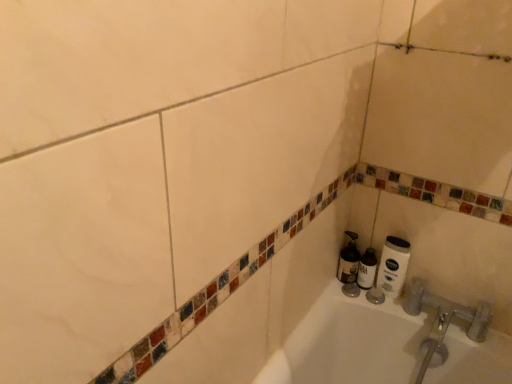
Question: Does white matte shaving cream at lower right, which appears as the first shaving cream when viewed from the left, have a lesser width compared to white matte toilet paper at lower right?

Choices:
 (A) yes
 (B) no

Answer: (B)

Question: Does white matte shaving cream at lower right, the 2th shaving cream from the right, have a lesser height compared to white matte toilet paper at lower right?

Choices:
 (A) yes
 (B) no

Answer: (A)

Question: Is white matte shaving cream at lower right, which appears as the first shaving cream when viewed from the left, oriented towards white matte toilet paper at lower right?

Choices:
 (A) no
 (B) yes

Answer: (A)

Question: Would you consider white matte shaving cream at lower right, which appears as the first shaving cream when viewed from the left, to be distant from white matte toilet paper at lower right?

Choices:
 (A) no
 (B) yes

Answer: (A)

Question: Is white matte shaving cream at lower right, the 2th shaving cream from the right, smaller than white matte toilet paper at lower right?

Choices:
 (A) no
 (B) yes

Answer: (A)

Question: Considering the positions of white matte toilet paper at lower right and white matte shaving cream at lower right, which is the 2th shaving cream in left-to-right order, in the image, is white matte toilet paper at lower right taller or shorter than white matte shaving cream at lower right, which is the 2th shaving cream in left-to-right order,?

Choices:
 (A) short
 (B) tall

Answer: (B)

Question: Looking at the image, does white matte toilet paper at lower right seem bigger or smaller compared to white matte shaving cream at lower right, placed as the first shaving cream when sorted from right to left?

Choices:
 (A) small
 (B) big

Answer: (B)

Question: Is white matte toilet paper at lower right spatially inside white matte shaving cream at lower right, placed as the first shaving cream when sorted from right to left, or outside of it?

Choices:
 (A) inside
 (B) outside

Answer: (B)

Question: From a real-world perspective, is white matte toilet paper at lower right positioned above or below white matte shaving cream at lower right, placed as the first shaving cream when sorted from right to left?

Choices:
 (A) below
 (B) above

Answer: (B)

Question: Is point tap(362, 271) closer or farther from the camera than point tap(402, 281)?

Choices:
 (A) farther
 (B) closer

Answer: (A)

Question: Looking at the image, does white matte shaving cream at lower right, placed as the first shaving cream when sorted from right to left, seem bigger or smaller compared to white matte toilet paper at lower right?

Choices:
 (A) big
 (B) small

Answer: (B)

Question: Is white matte shaving cream at lower right, placed as the first shaving cream when sorted from right to left, situated inside white matte toilet paper at lower right or outside?

Choices:
 (A) inside
 (B) outside

Answer: (B)

Question: Relative to white matte toilet paper at lower right, is white matte shaving cream at lower right, which is the 2th shaving cream in left-to-right order, in front or behind?

Choices:
 (A) front
 (B) behind

Answer: (B)

Question: Considering the positions of point (348, 279) and point (394, 241), is point (348, 279) closer or farther from the camera than point (394, 241)?

Choices:
 (A) closer
 (B) farther

Answer: (B)

Question: Do you think white matte shaving cream at lower right, which appears as the first shaving cream when viewed from the left, is within white matte toilet paper at lower right, or outside of it?

Choices:
 (A) outside
 (B) inside

Answer: (A)